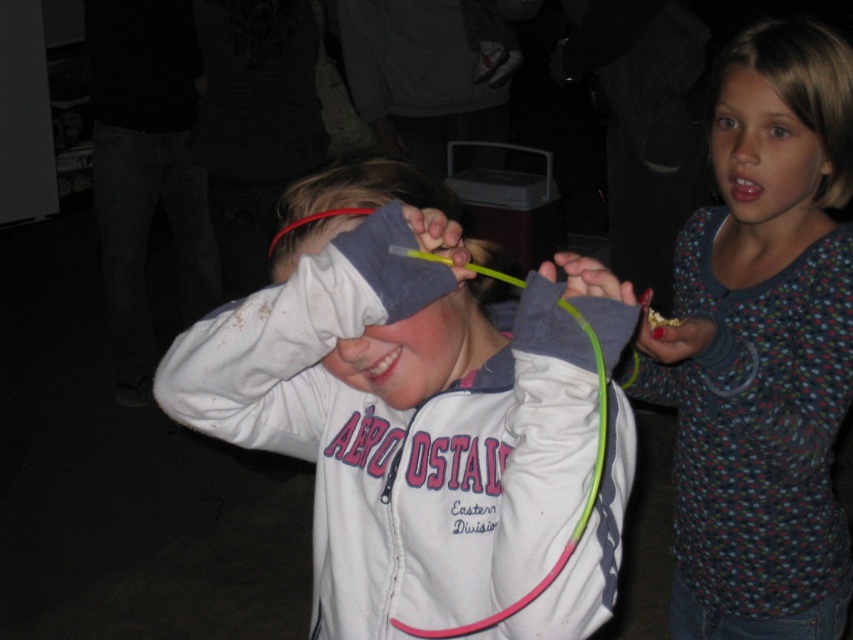
Which of these two, smooth gray cloth at center or brown shiny eye at upper right, stands taller?

smooth gray cloth at center is taller.

Who is more forward, (463, 301) or (764, 132)?

Positioned in front is point (463, 301).

Where is `smooth gray cloth at center`? This screenshot has width=853, height=640. smooth gray cloth at center is located at coordinates (408, 353).

I want to click on smooth gray cloth at center, so tap(408, 353).

From the picture: Who is positioned more to the left, smooth skin nose at upper right or smooth glossy teeth at upper right?

smooth skin nose at upper right

Is point (746, 163) positioned in front of point (737, 189)?

Yes, point (746, 163) is in front of point (737, 189).

This screenshot has width=853, height=640. What are the coordinates of `smooth skin nose at upper right` in the screenshot? It's located at (738, 141).

Who is positioned more to the left, polka dot sweater at right or brown shiny eye at upper right?

polka dot sweater at right is more to the left.

Who is more forward, (848, 150) or (788, 131)?

Point (788, 131) is in front.

Measure the distance between polka dot sweater at right and camera.

A distance of 36.87 inches exists between polka dot sweater at right and camera.

Locate an element on the screen. The image size is (853, 640). polka dot sweater at right is located at coordinates (763, 369).